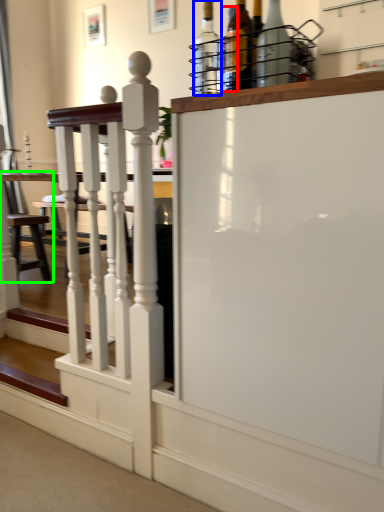
Question: Which object is positioned farthest from bottle (highlighted by a red box)? Select from bottle (highlighted by a blue box) and armchair (highlighted by a green box).

Choices:
 (A) bottle
 (B) armchair

Answer: (B)